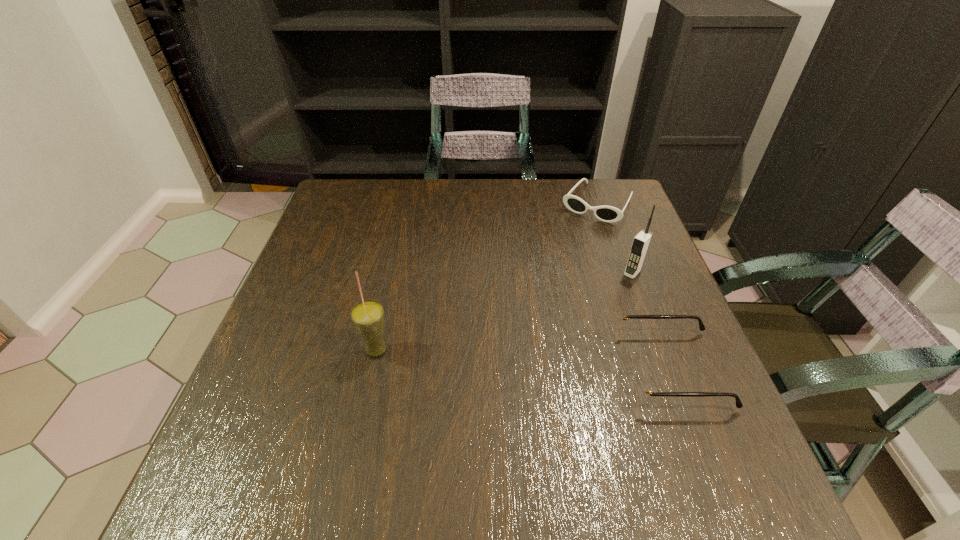
You are a GUI agent. You are given a task and a screenshot of the screen. Output one action in this format:
    pyautogui.click(x=<x>, y=<y>)
    Task: Click on the free space on the desktop that is between the leftmost object and the spectacles and is positioned on the front-facing side of the second farthest object
    
    Given the screenshot: What is the action you would take?
    pyautogui.click(x=551, y=361)

The width and height of the screenshot is (960, 540). In order to click on free space on the desktop that is between the straw for drinking and the spectacles and is positioned with the lenses of the sunglasses facing outward in this screenshot , I will do `click(491, 357)`.